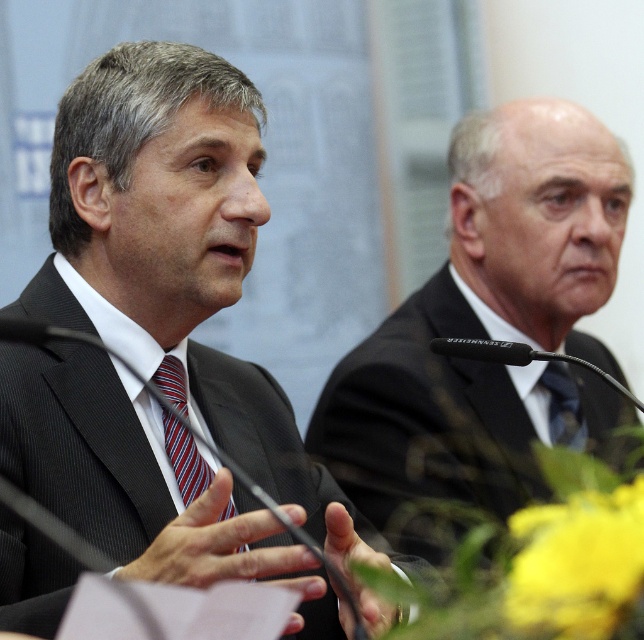
Question: Considering the real-world distances, which object is farthest from the dark gray suit at left?

Choices:
 (A) matte blue tie at center
 (B) black suit at right
 (C) striped fabric tie at center

Answer: (A)

Question: Which point is farther to the camera?

Choices:
 (A) matte blue tie at center
 (B) dark gray suit at left
 (C) black suit at right
 (D) striped fabric tie at center

Answer: (A)

Question: Can you confirm if dark gray suit at left is positioned below striped fabric tie at center?

Choices:
 (A) no
 (B) yes

Answer: (A)

Question: Does black suit at right come in front of striped fabric tie at center?

Choices:
 (A) no
 (B) yes

Answer: (A)

Question: Which of the following is the closest to the observer?

Choices:
 (A) black suit at right
 (B) striped fabric tie at center
 (C) matte blue tie at center

Answer: (B)

Question: Can you confirm if dark gray suit at left is wider than matte blue tie at center?

Choices:
 (A) no
 (B) yes

Answer: (B)